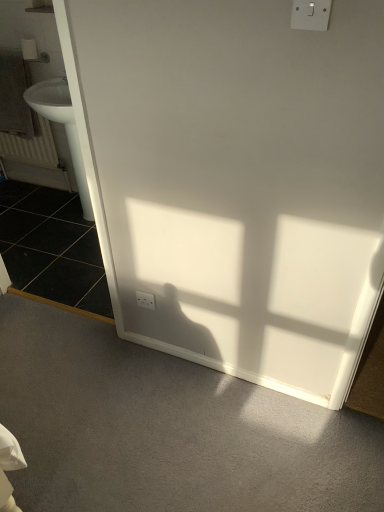
Question: In the image, is gray textured towel at left positioned in front of or behind white plastic switch at upper right, placed as the first electric outlet when sorted from top to bottom?

Choices:
 (A) front
 (B) behind

Answer: (B)

Question: Considering the relative positions of gray textured towel at left and white plastic switch at upper right, the second electric outlet viewed from the back, in the image provided, is gray textured towel at left to the left or to the right of white plastic switch at upper right, the second electric outlet viewed from the back,?

Choices:
 (A) left
 (B) right

Answer: (A)

Question: Which object is the farthest from the white matte toilet paper at upper left?

Choices:
 (A) gray textured towel at left
 (B) white plastic switch at upper right, placed as the first electric outlet when sorted from top to bottom
 (C) white matte radiator at left
 (D) black tile at left
 (E) white plastic electric outlet at lower left, acting as the 2th electric outlet starting from the front

Answer: (B)

Question: Which of these objects is positioned closest to the white plastic electric outlet at lower left, which is counted as the first electric outlet, starting from the bottom?

Choices:
 (A) white plastic switch at upper right, the first electric outlet when ordered from front to back
 (B) white matte toilet paper at upper left
 (C) gray textured towel at left
 (D) black tile at left
 (E) white matte radiator at left

Answer: (D)